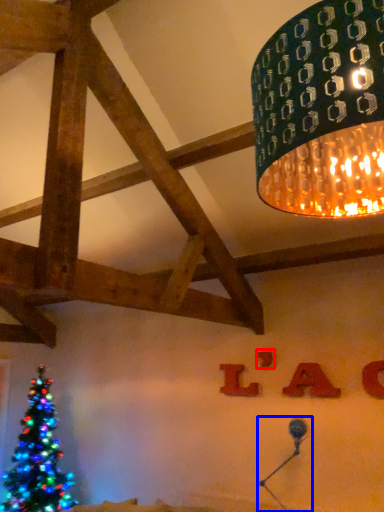
Question: Which of the following is the closest to the observer, letter (highlighted by a red box) or table lamp (highlighted by a blue box)?

Choices:
 (A) letter
 (B) table lamp

Answer: (B)